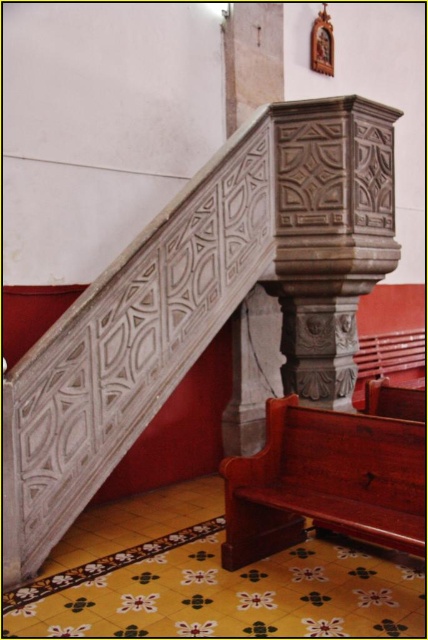
Question: Which object appears closest to the camera in this image?

Choices:
 (A) mahogany wood church bench at lower right
 (B) white stone staircase at upper left

Answer: (A)

Question: Is the position of white stone staircase at upper left more distant than that of mahogany wood church bench at lower right?

Choices:
 (A) no
 (B) yes

Answer: (B)

Question: Is white stone staircase at upper left closer to camera compared to mahogany wood church bench at lower right?

Choices:
 (A) no
 (B) yes

Answer: (A)

Question: Does white stone staircase at upper left have a smaller size compared to mahogany wood church bench at lower right?

Choices:
 (A) yes
 (B) no

Answer: (B)